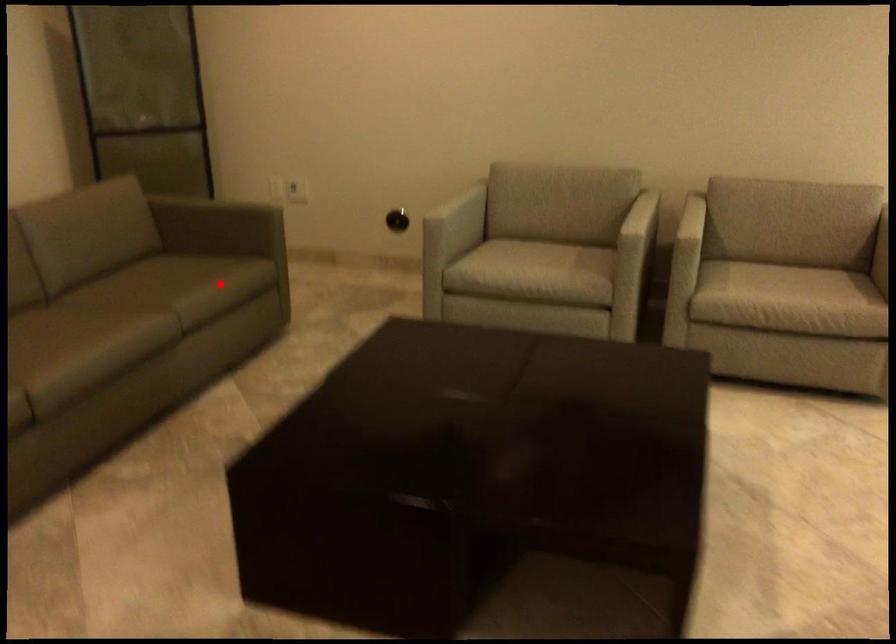
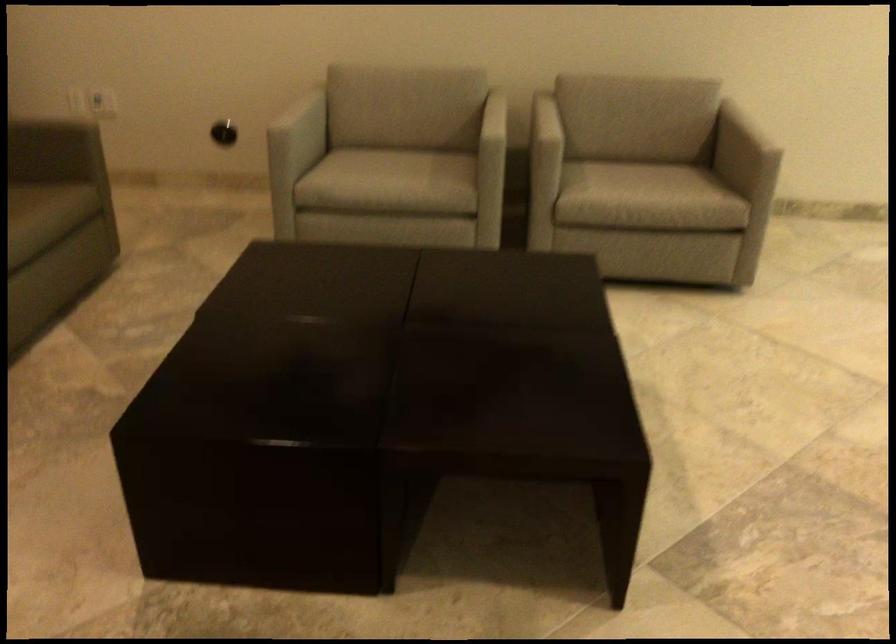
Find the pixel in the second image that matches the highlighted location in the first image.

(36, 219)